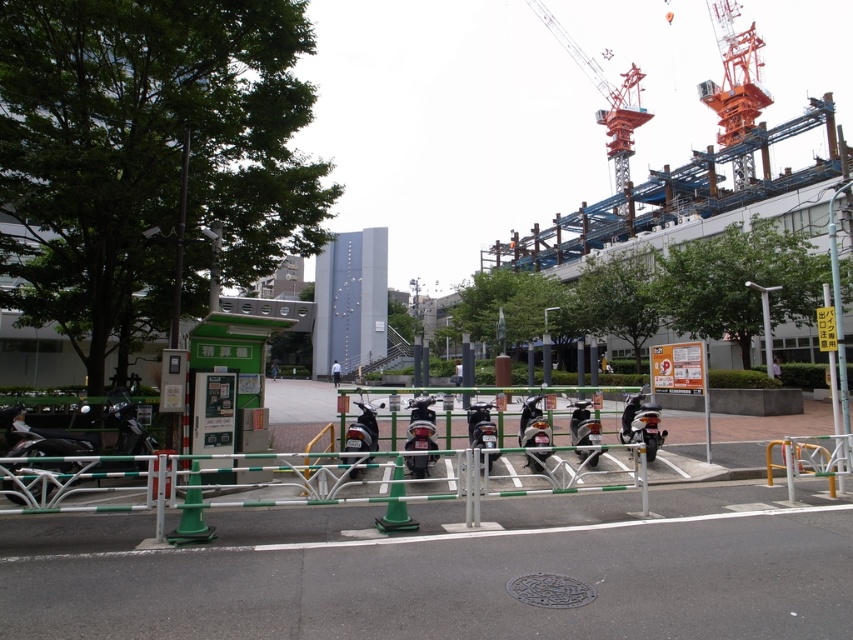
You are planning to install a new billboard in the urban scene. The billboard requires a structure taller than the white matte person at center to ensure visibility. Can the orange metallic crane at upper right be used as the billboard support structure?

The orange metallic crane at upper right has a greater height compared to the white matte person at center, so it can be used as the billboard support structure to ensure visibility.

You are standing at the parking area for scooters enclosed by a green and white metal barrier and want to take a photo of the orange metallic crane at upper right. From your current position, in which direction should you look to capture the crane in your view?

The orange metallic crane at upper right is located at point coordinates approximately 0.155 on the x axis and 0.712 on the y axis. Since you are at the parking area near the lower part of the image, you should look towards the upper right direction to capture the crane in your view.